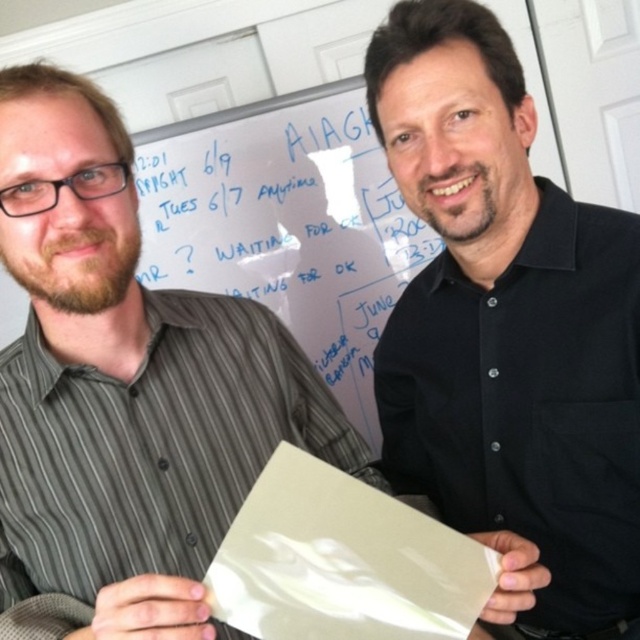
Question: Does black matte paper at center appear under white glossy paper at center?

Choices:
 (A) no
 (B) yes

Answer: (A)

Question: Is black matte paper at center below white glossy paper at center?

Choices:
 (A) yes
 (B) no

Answer: (B)

Question: Does black matte paper at center have a larger size compared to white glossy paper at center?

Choices:
 (A) no
 (B) yes

Answer: (B)

Question: Among these objects, which one is nearest to the camera?

Choices:
 (A) white glossy paper at center
 (B) black matte paper at center

Answer: (A)